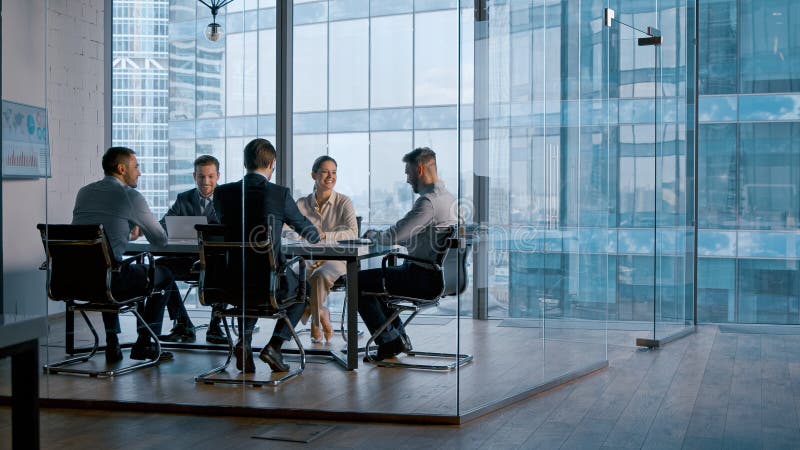
Identify the location of metal framework to the walls. The image size is (800, 450). (144, 404), (513, 400), (644, 344), (673, 338).